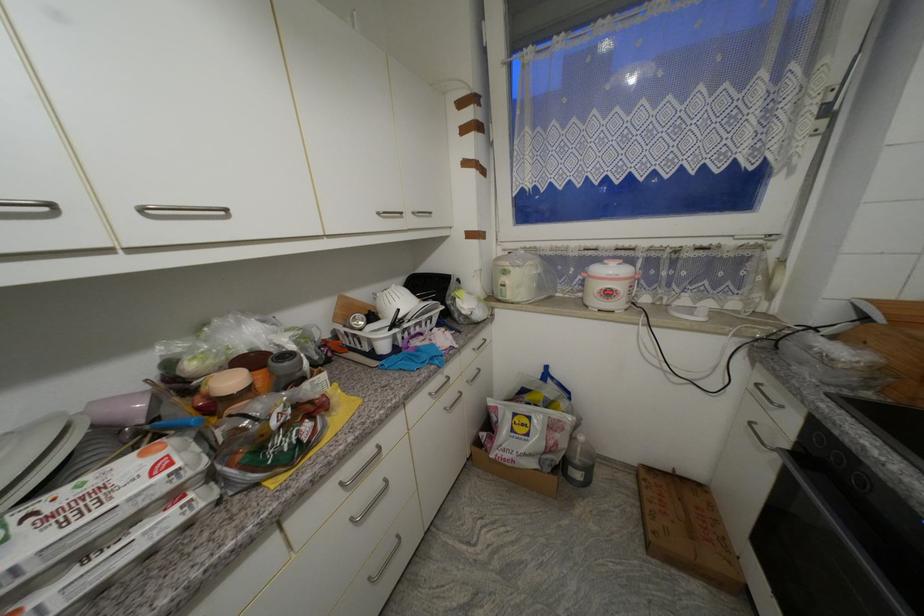
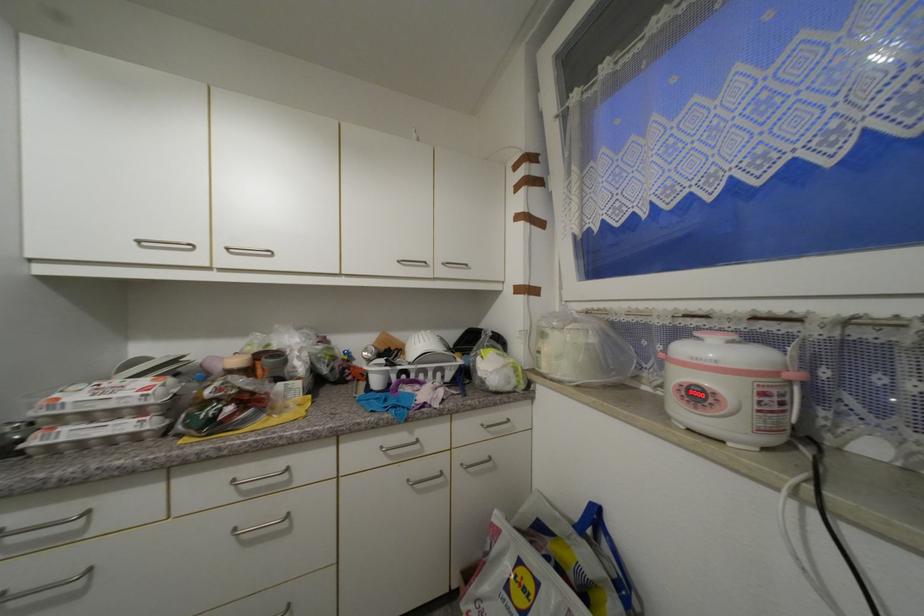
In the second image, find the point that corresponds to point (419, 215) in the first image.

(448, 265)